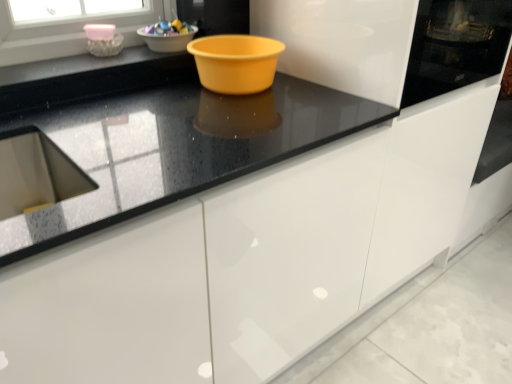
Question: From the image's perspective, is matte plastic bowl at upper center, acting as the second basin starting from the left, on top of black glossy countertop at center?

Choices:
 (A) yes
 (B) no

Answer: (A)

Question: Does matte plastic bowl at upper center, which appears as the 1th basin when viewed from the right, have a lesser height compared to black glossy countertop at center?

Choices:
 (A) no
 (B) yes

Answer: (B)

Question: Is matte plastic bowl at upper center, acting as the second basin starting from the left, positioned beyond the bounds of black glossy countertop at center?

Choices:
 (A) yes
 (B) no

Answer: (A)

Question: From a real-world perspective, does matte plastic bowl at upper center, which appears as the 1th basin when viewed from the right, sit lower than black glossy countertop at center?

Choices:
 (A) yes
 (B) no

Answer: (B)

Question: Is matte plastic bowl at upper center, acting as the second basin starting from the left, wider than black glossy countertop at center?

Choices:
 (A) no
 (B) yes

Answer: (A)

Question: Is matte plastic bowl at upper center, acting as the second basin starting from the left, at the left side of black glossy countertop at center?

Choices:
 (A) yes
 (B) no

Answer: (A)

Question: Is matte plastic bowl at upper center, acting as the second basin starting from the left, beside shiny plastic bowl at upper center?

Choices:
 (A) no
 (B) yes

Answer: (B)

Question: Can you confirm if matte plastic bowl at upper center, which appears as the 1th basin when viewed from the right, is wider than shiny plastic bowl at upper center?

Choices:
 (A) no
 (B) yes

Answer: (A)

Question: Is shiny plastic bowl at upper center at the back of matte plastic bowl at upper center, which appears as the 1th basin when viewed from the right?

Choices:
 (A) yes
 (B) no

Answer: (B)

Question: Is matte plastic bowl at upper center, acting as the second basin starting from the left, thinner than shiny plastic bowl at upper center?

Choices:
 (A) no
 (B) yes

Answer: (B)

Question: Is matte plastic bowl at upper center, acting as the second basin starting from the left, smaller than shiny plastic bowl at upper center?

Choices:
 (A) no
 (B) yes

Answer: (A)

Question: Does matte plastic bowl at upper center, which appears as the 1th basin when viewed from the right, have a greater height compared to shiny plastic bowl at upper center?

Choices:
 (A) no
 (B) yes

Answer: (B)

Question: Is black glossy countertop at upper center in contact with pink glass bowl at upper left, which is the first basin in left-to-right order?

Choices:
 (A) no
 (B) yes

Answer: (A)